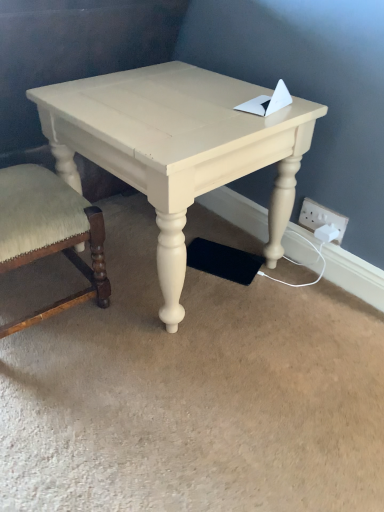
Measure the distance between point (343, 232) and camera.

Point (343, 232) and camera are 1.19 meters apart.

This screenshot has width=384, height=512. What do you see at coordinates (176, 147) in the screenshot?
I see `matte cream table at center` at bounding box center [176, 147].

Where is `velvet beige chair at lower left`? velvet beige chair at lower left is located at coordinates (48, 232).

Identify the location of white plastic electric outlet at lower right. (321, 218).

Does white plastic electric outlet at lower right appear on the right side of matte cream table at center?

Yes, white plastic electric outlet at lower right is to the right of matte cream table at center.

Relative to matte cream table at center, is white plastic electric outlet at lower right in front or behind?

In the image, white plastic electric outlet at lower right appears behind matte cream table at center.

Are white plastic electric outlet at lower right and matte cream table at center making contact?

No.

Could you tell me if white plastic electric outlet at lower right is facing matte cream table at center?

No, white plastic electric outlet at lower right is not facing towards matte cream table at center.

Image resolution: width=384 pixels, height=512 pixels. I want to click on chair below the white plastic electric outlet at lower right (from the image's perspective), so click(x=48, y=232).

Is the depth of velvet beige chair at lower left greater than that of white plastic electric outlet at lower right?

No, velvet beige chair at lower left is in front of white plastic electric outlet at lower right.

Looking at this image, is velvet beige chair at lower left taller than white plastic electric outlet at lower right?

Correct, velvet beige chair at lower left is much taller as white plastic electric outlet at lower right.

Could you tell me if velvet beige chair at lower left is turned towards white plastic electric outlet at lower right?

No, velvet beige chair at lower left is not facing towards white plastic electric outlet at lower right.

From the image's perspective, is matte cream table at center located above or below white plastic electric outlet at lower right?

From the image's perspective, matte cream table at center appears above white plastic electric outlet at lower right.

Which object is positioned more to the right, matte cream table at center or white plastic electric outlet at lower right?

Positioned to the right is white plastic electric outlet at lower right.

The image size is (384, 512). What are the coordinates of `electric outlet behind the matte cream table at center` in the screenshot? It's located at (321, 218).

Looking at this image, is velvet beige chair at lower left located within white plastic electric outlet at lower right?

That's incorrect, velvet beige chair at lower left is not inside white plastic electric outlet at lower right.

Is velvet beige chair at lower left at the back of white plastic electric outlet at lower right?

No, white plastic electric outlet at lower right is not facing the opposite direction of velvet beige chair at lower left.

Which of these two, white plastic electric outlet at lower right or velvet beige chair at lower left, is smaller?

white plastic electric outlet at lower right is smaller.

Who is shorter, matte cream table at center or velvet beige chair at lower left?

velvet beige chair at lower left.

From a real-world perspective, which is physically above, matte cream table at center or velvet beige chair at lower left?

In real-world perspective, matte cream table at center is above.

Is matte cream table at center located outside velvet beige chair at lower left?

Yes, matte cream table at center is not within velvet beige chair at lower left.

Is matte cream table at center directly adjacent to velvet beige chair at lower left?

There is a gap between matte cream table at center and velvet beige chair at lower left.

From a real-world perspective, is velvet beige chair at lower left positioned above or below matte cream table at center?

velvet beige chair at lower left is below matte cream table at center.

Between velvet beige chair at lower left and matte cream table at center, which one appears on the left side from the viewer's perspective?

From the viewer's perspective, velvet beige chair at lower left appears more on the left side.

Where is `table above the velvet beige chair at lower left (from a real-world perspective)`? The width and height of the screenshot is (384, 512). table above the velvet beige chair at lower left (from a real-world perspective) is located at coordinates (176, 147).

Locate an element on the screen. The height and width of the screenshot is (512, 384). electric outlet that appears below the matte cream table at center (from a real-world perspective) is located at coordinates (321, 218).

Image resolution: width=384 pixels, height=512 pixels. What are the coordinates of `electric outlet above the velvet beige chair at lower left (from the image's perspective)` in the screenshot? It's located at (321, 218).

Which object lies nearer to the anchor point velvet beige chair at lower left, white plastic electric outlet at lower right or matte cream table at center?

matte cream table at center is positioned closer to the anchor velvet beige chair at lower left.

Based on their spatial positions, is matte cream table at center or white plastic electric outlet at lower right closer to velvet beige chair at lower left?

matte cream table at center.

When comparing their distances from white plastic electric outlet at lower right, does velvet beige chair at lower left or matte cream table at center seem closer?

matte cream table at center lies closer to white plastic electric outlet at lower right than the other object.

Considering their positions, is matte cream table at center positioned further to white plastic electric outlet at lower right than velvet beige chair at lower left?

Based on the image, velvet beige chair at lower left appears to be further to white plastic electric outlet at lower right.

Considering their positions, is velvet beige chair at lower left positioned closer to matte cream table at center than white plastic electric outlet at lower right?

The object closer to matte cream table at center is velvet beige chair at lower left.

Based on the photo, estimate the real-world distances between objects in this image. Which object is further from matte cream table at center, white plastic electric outlet at lower right or velvet beige chair at lower left?

white plastic electric outlet at lower right is further to matte cream table at center.

The image size is (384, 512). I want to click on table between velvet beige chair at lower left and white plastic electric outlet at lower right, so click(x=176, y=147).